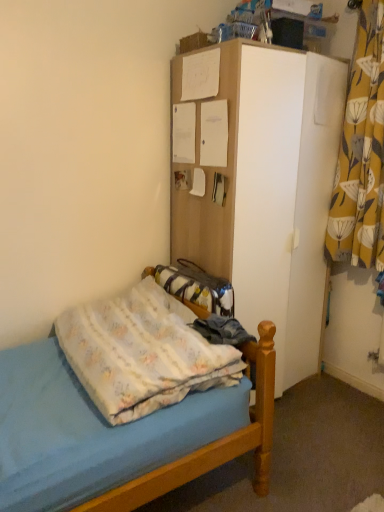
Question: From a real-world perspective, is white matte cabinet at upper center above or below light blue fabric bed at lower left?

Choices:
 (A) below
 (B) above

Answer: (B)

Question: Is white matte cabinet at upper center taller or shorter than light blue fabric bed at lower left?

Choices:
 (A) short
 (B) tall

Answer: (B)

Question: Which is nearer to the light blue fabric bed at lower left?

Choices:
 (A) yellow floral fabric curtain at right
 (B) fluffy cotton blanket at lower left
 (C) white matte cabinet at upper center

Answer: (B)

Question: Based on their relative distances, which object is nearer to the yellow floral fabric curtain at right?

Choices:
 (A) light blue fabric bed at lower left
 (B) white matte cabinet at upper center
 (C) fluffy cotton blanket at lower left

Answer: (B)